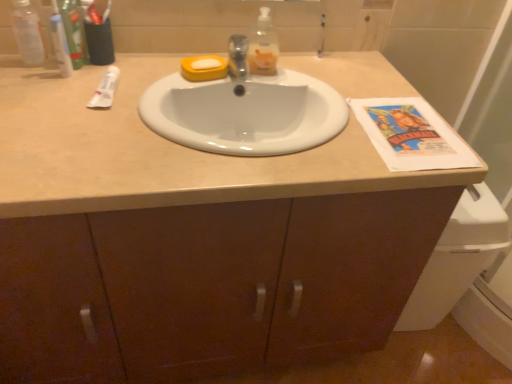
Locate an element on the screen. The width and height of the screenshot is (512, 384). free space on the front side of white matte tube at upper left is located at coordinates [81, 130].